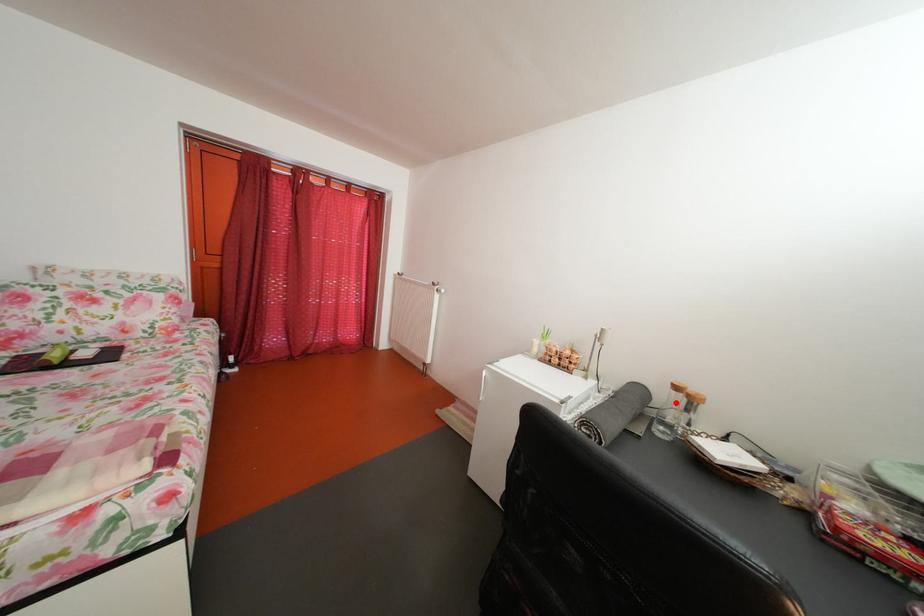
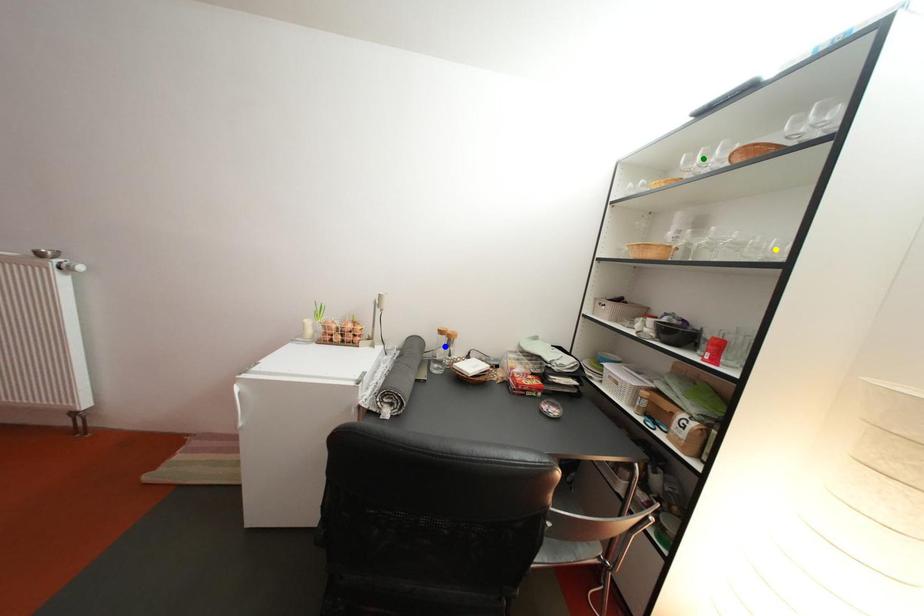
Question: I am providing you with two images of the same scene from different viewpoints. A red point is marked on the first image. You are given multiple points on the second image. In image 2, which mark is for the same physical point as the one in image 1?

Choices:
 (A) blue point
 (B) green point
 (C) yellow point

Answer: (A)